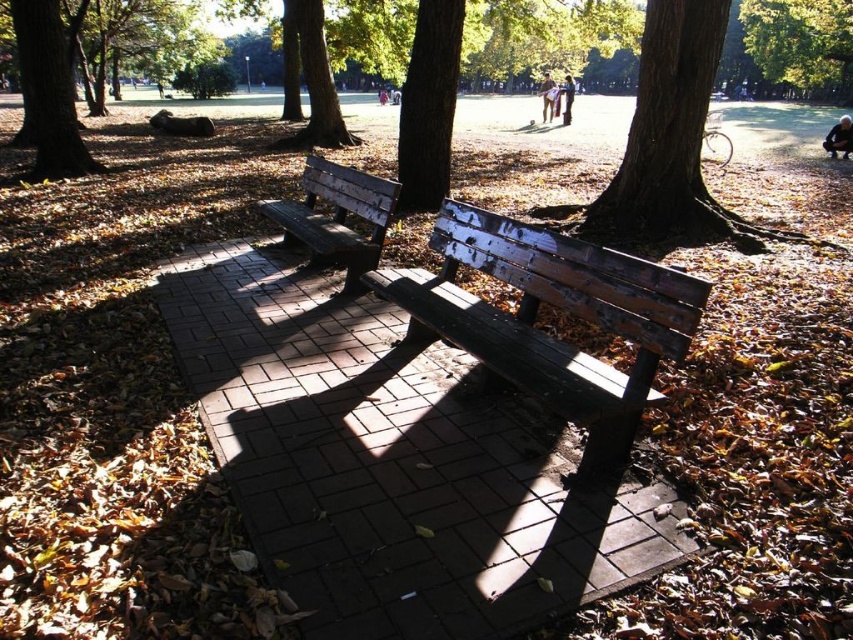
Is the position of wooden bench at center more distant than that of light brown wooden bench at center?

No, wooden bench at center is in front of light brown wooden bench at center.

Does wooden bench at center have a lesser height compared to light brown wooden bench at center?

Correct, wooden bench at center is not as tall as light brown wooden bench at center.

Is point (334, 200) closer to camera compared to point (548, 122)?

Yes, point (334, 200) is closer to viewer.

Locate an element on the screen. Image resolution: width=853 pixels, height=640 pixels. wooden bench at center is located at coordinates (335, 216).

Does point (407, 140) come in front of point (321, 193)?

No.

Can you confirm if brown rough bark tree at center is positioned above wooden bench at center?

Yes.

Who is more forward, (415,60) or (321,216)?

Positioned in front is point (321,216).

The height and width of the screenshot is (640, 853). In order to click on brown rough bark tree at center in this screenshot , I will do `click(428, 106)`.

Does brown rough tree at upper left come in front of light brown leather jacket at upper center?

Yes, it is.

Is brown rough tree at upper left smaller than light brown leather jacket at upper center?

No, brown rough tree at upper left is not smaller than light brown leather jacket at upper center.

Does point (22, 38) come in front of point (570, 108)?

Yes.

Where is `brown rough tree at upper left`? Image resolution: width=853 pixels, height=640 pixels. brown rough tree at upper left is located at coordinates (48, 92).